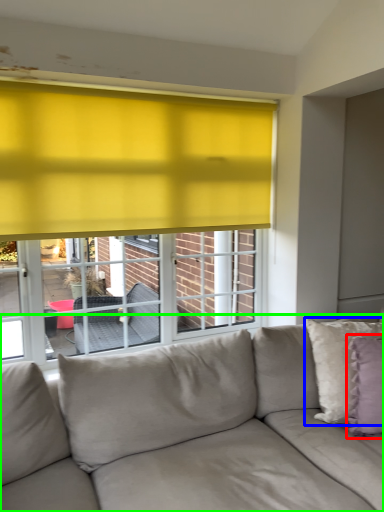
Question: Considering the real-world distances, which object is farthest from pillow (highlighted by a red box)? pillow (highlighted by a blue box) or studio couch (highlighted by a green box)?

Choices:
 (A) pillow
 (B) studio couch

Answer: (B)